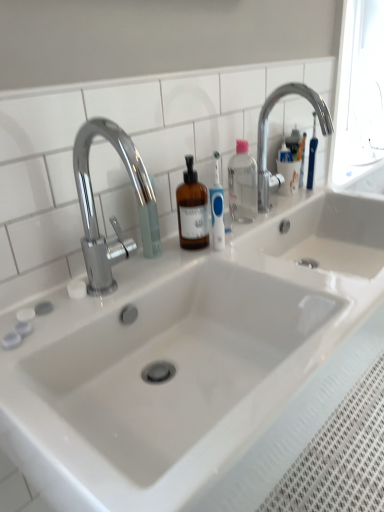
Question: From their relative heights in the image, would you say chrome metallic faucet at left, acting as the 2th tap starting from the back, is taller or shorter than clear plastic bottle at center?

Choices:
 (A) short
 (B) tall

Answer: (B)

Question: Considering the relative positions of chrome metallic faucet at left, acting as the 2th tap starting from the back, and clear plastic bottle at center in the image provided, is chrome metallic faucet at left, acting as the 2th tap starting from the back, to the left or to the right of clear plastic bottle at center?

Choices:
 (A) right
 (B) left

Answer: (B)

Question: Based on their relative distances, which object is nearer to the clear plastic bottle at center?

Choices:
 (A) chrome metallic faucet at left, which is counted as the second tap, starting from the right
 (B) chrome metallic faucet at upper right, which is counted as the 1th tap, starting from the back

Answer: (B)

Question: Which is nearer to the chrome metallic faucet at upper right, which is counted as the 1th tap, starting from the back?

Choices:
 (A) clear plastic bottle at center
 (B) chrome metallic faucet at left, arranged as the 1th tap when viewed from the left

Answer: (A)